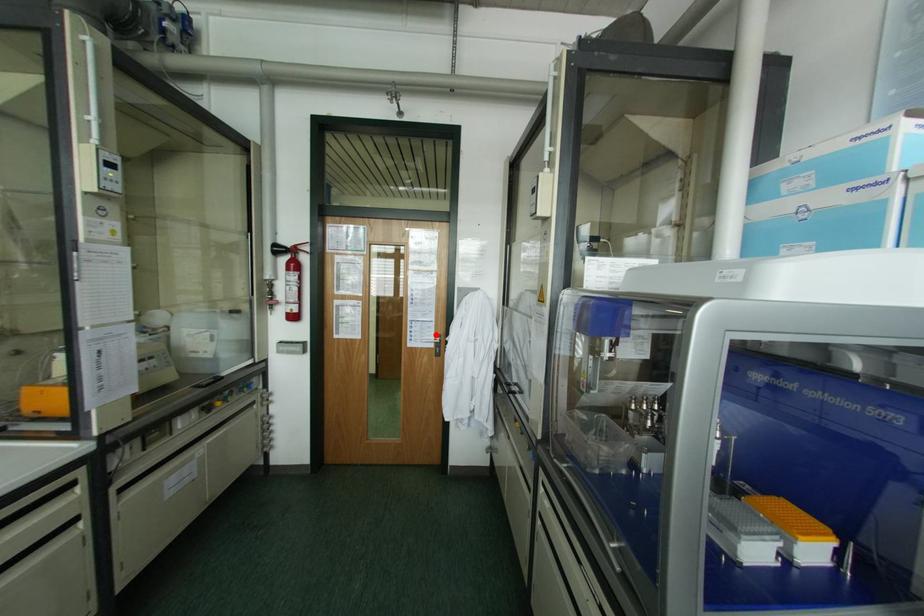
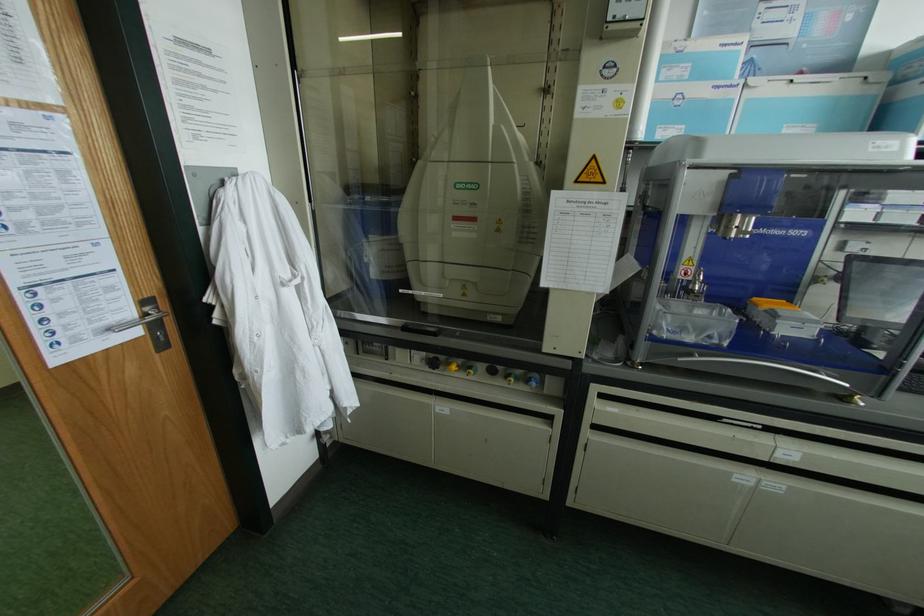
Locate, in the second image, the point that corresponds to the highlighted location in the first image.

(142, 302)